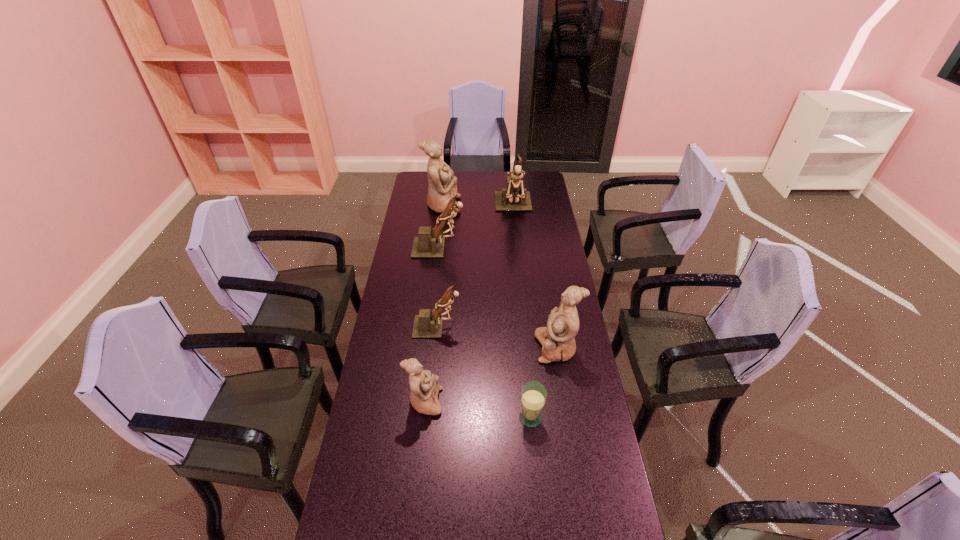
Identify the location of the second closest figurine to the biggest white figurine. Image resolution: width=960 pixels, height=540 pixels. (427, 245).

The height and width of the screenshot is (540, 960). Find the location of `figurine that stands as the fourth closest to the blue glass`. figurine that stands as the fourth closest to the blue glass is located at coordinates (427, 245).

You are a GUI agent. You are given a task and a screenshot of the screen. Output one action in this format:
    pyautogui.click(x=<x>, y=<y>)
    Task: Click on the white figurine object that ranks as the second closest to the farthest white figurine
    
    Given the screenshot: What is the action you would take?
    pyautogui.click(x=424, y=385)

The height and width of the screenshot is (540, 960). What are the coordinates of `white figurine that is the third closest to the shortest object` in the screenshot? It's located at (442, 187).

What are the coordinates of `the second closest brown figurine to the fourth nearest figurine` in the screenshot? It's located at (428, 324).

Locate an element on the screen. The height and width of the screenshot is (540, 960). the third closest brown figurine to the second nearest white figurine is located at coordinates (512, 198).

Where is `vacant space that satisfies the following two spatial constraints: 1. on the front-facing side of the glass; 2. on the left side of the nearest figurine`? vacant space that satisfies the following two spatial constraints: 1. on the front-facing side of the glass; 2. on the left side of the nearest figurine is located at coordinates (423, 417).

The height and width of the screenshot is (540, 960). I want to click on vacant space that satisfies the following two spatial constraints: 1. on the front-facing side of the glass; 2. on the right side of the biggest white figurine, so click(x=419, y=417).

This screenshot has width=960, height=540. Find the location of `blank area in the image that satisfies the following two spatial constraints: 1. on the front-facing side of the biggest brown figurine; 2. on the front-facing side of the smallest white figurine`. blank area in the image that satisfies the following two spatial constraints: 1. on the front-facing side of the biggest brown figurine; 2. on the front-facing side of the smallest white figurine is located at coordinates (533, 402).

Where is `vacant space that satisfies the following two spatial constraints: 1. on the front-facing side of the nearest figurine; 2. on the back side of the glass`? vacant space that satisfies the following two spatial constraints: 1. on the front-facing side of the nearest figurine; 2. on the back side of the glass is located at coordinates (423, 417).